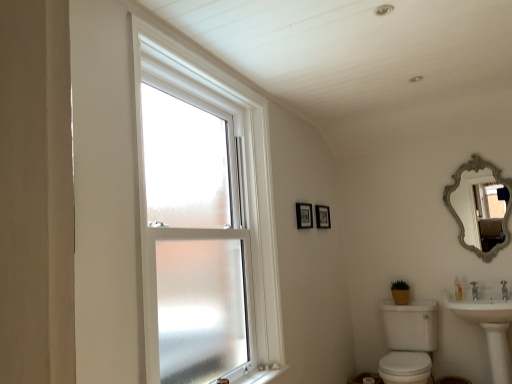
Question: From a real-world perspective, relative to white glossy sink at lower right, the second sink positioned from the left, is matte black picture frame at upper center, which ranks as the first picture frame in front-to-back order, vertically above or below?

Choices:
 (A) below
 (B) above

Answer: (B)

Question: Considering the positions of matte black picture frame at upper center, marked as the 2th picture frame in a right-to-left arrangement, and white glossy sink at lower right, the 1th sink viewed from the right, in the image, is matte black picture frame at upper center, marked as the 2th picture frame in a right-to-left arrangement, bigger or smaller than white glossy sink at lower right, the 1th sink viewed from the right,?

Choices:
 (A) big
 (B) small

Answer: (B)

Question: Which of these objects is positioned farthest from the frosted glass window at center?

Choices:
 (A) white glossy sink at lower right, arranged as the 2th sink when viewed from the right
 (B) silver/gilded ornate mirror at upper right
 (C) matte black picture frame at upper center, which ranks as the 2th picture frame in back-to-front order
 (D) white plastic window sill at lower center
 (E) white glossy sink at lower right, the second sink positioned from the left

Answer: (B)

Question: Estimate the real-world distances between objects in this image. Which object is farther from the white glossy sink at lower right, the first sink positioned from the left?

Choices:
 (A) wooden picture frame at upper center, positioned as the 1th picture frame in right-to-left order
 (B) frosted glass window at center
 (C) white plastic window sill at lower center
 (D) matte black picture frame at upper center, marked as the 2th picture frame in a right-to-left arrangement
 (E) silver/gilded ornate mirror at upper right

Answer: (B)